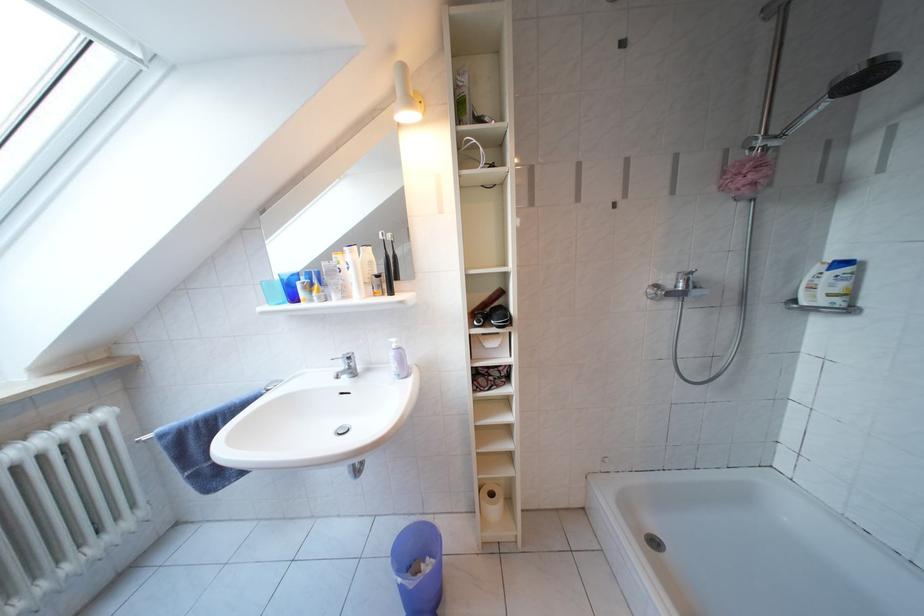
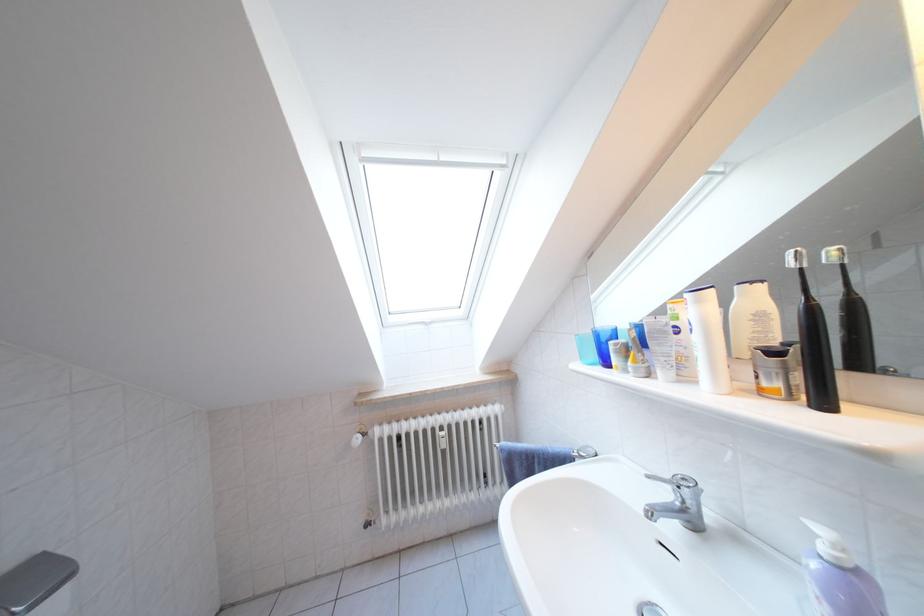
The point at (349, 371) is marked in the first image. Where is the corresponding point in the second image?

(675, 500)